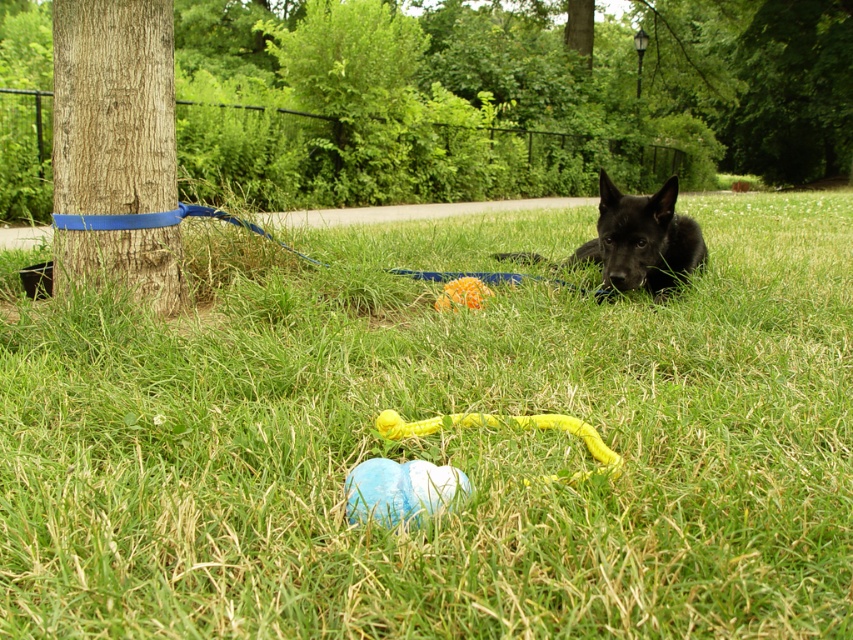
Between brown rough bark at left and blue rubber leash at left, which one is positioned higher?

Positioned higher is brown rough bark at left.

Is brown rough bark at left to the left of blue rubber leash at left from the viewer's perspective?

Indeed, brown rough bark at left is positioned on the left side of blue rubber leash at left.

Where is `brown rough bark at left`? The height and width of the screenshot is (640, 853). brown rough bark at left is located at coordinates (112, 106).

Can you confirm if green grass at lower center is taller than brown rough bark at left?

No.

Can you confirm if green grass at lower center is positioned to the left of brown rough bark at left?

No, green grass at lower center is not to the left of brown rough bark at left.

Between point (421, 369) and point (106, 145), which one is positioned behind?

Positioned behind is point (106, 145).

Where is `green grass at lower center`? This screenshot has height=640, width=853. green grass at lower center is located at coordinates (440, 442).

Is blue rubber leash at left positioned behind yellow rubber leash at lower center?

Yes, blue rubber leash at left is further from the viewer.

Is blue rubber leash at left closer to the viewer compared to yellow rubber leash at lower center?

No.

Looking at this image, measure the distance between blue rubber leash at left and camera.

A distance of 10.80 feet exists between blue rubber leash at left and camera.

At what (x,y) coordinates should I click in order to perform the action: click on blue rubber leash at left. Please return your answer as a coordinate pair (x, y). The image size is (853, 640). Looking at the image, I should click on (164, 221).